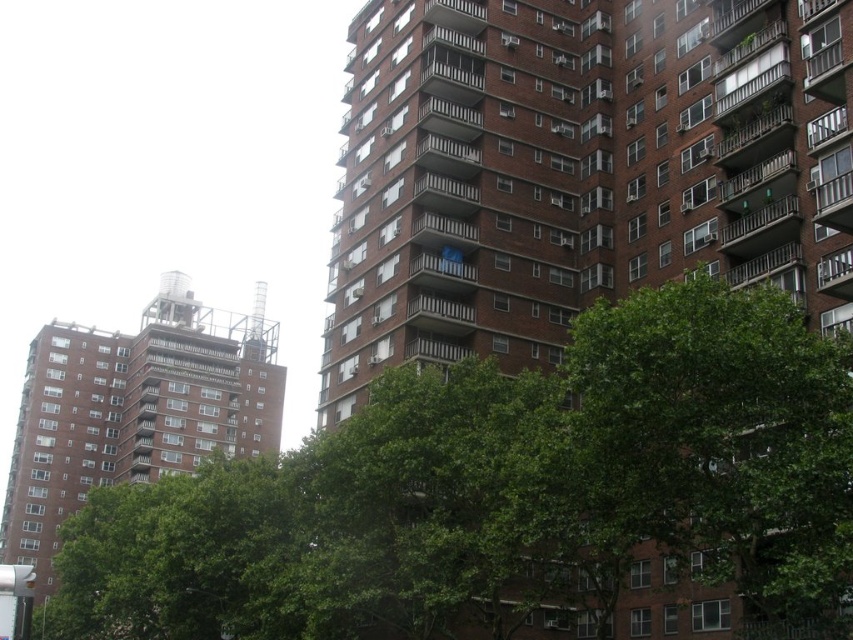
You are standing at the point labeled point (508,492) in the image. Which object is directly in front of you?

The point labeled point (508,492) corresponds to a green leafy tree at lower left, so the green leafy tree at lower left is directly in front of you.

You are a city planner assessing the urban space between the two residential buildings. You notice the green leafy tree at lower left and the green leafy tree at center. Which tree is taller?

The green leafy tree at lower left is taller than the green leafy tree at center.

You are a city planner assessing the space between the green leafy tree at center and the brown brick building at left. Based on their widths, which one occupies more horizontal space in the image?

The brown brick building at left has a greater width than the green leafy tree at center, so it occupies more horizontal space in the image.